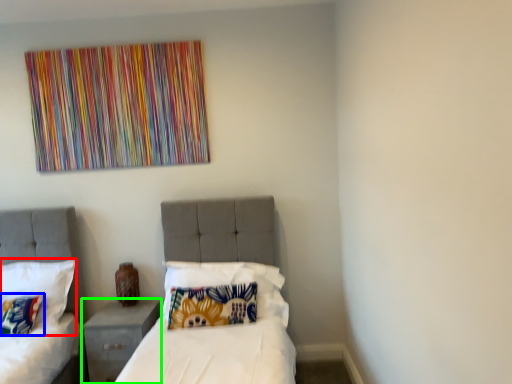
Question: Considering the real-world distances, which object is farthest from pillow (highlighted by a red box)? pillow (highlighted by a blue box) or nightstand (highlighted by a green box)?

Choices:
 (A) pillow
 (B) nightstand

Answer: (B)